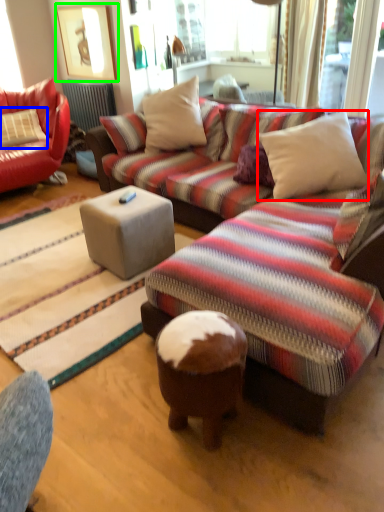
Question: Based on their relative distances, which object is farther from pillow (highlighted by a red box)? Choose from pillow (highlighted by a blue box) and picture frame (highlighted by a green box).

Choices:
 (A) pillow
 (B) picture frame

Answer: (B)